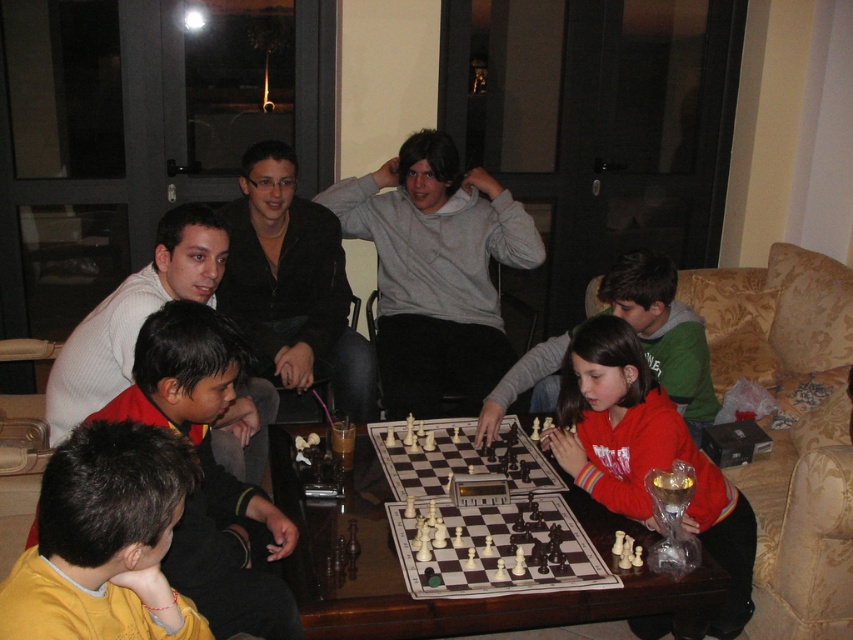
Who is more distant from viewer, (160, 412) or (695, 497)?

Positioned behind is point (695, 497).

Who is taller, dark brown hair at lower left or matte red hoodie at center?

Standing taller between the two is matte red hoodie at center.

Between point (212, 532) and point (601, 419), which one is positioned behind?

The point (601, 419) is more distant.

Identify the location of dark brown hair at lower left. (210, 474).

Between yellow fabric shirt at lower left and matte red hoodie at center, which one appears on the right side from the viewer's perspective?

matte red hoodie at center

Between point (161, 516) and point (608, 401), which one is positioned behind?

Positioned behind is point (608, 401).

The image size is (853, 640). In order to click on yellow fabric shirt at lower left in this screenshot , I will do (x=103, y=540).

Which is below, matte red hoodie at center or red fleece jacket at center?

matte red hoodie at center is lower down.

Is matte red hoodie at center taller than red fleece jacket at center?

Indeed, matte red hoodie at center has a greater height compared to red fleece jacket at center.

Is point (669, 445) positioned before point (680, 346)?

Yes, point (669, 445) is in front of point (680, 346).

Locate an element on the screen. This screenshot has width=853, height=640. matte red hoodie at center is located at coordinates tap(645, 452).